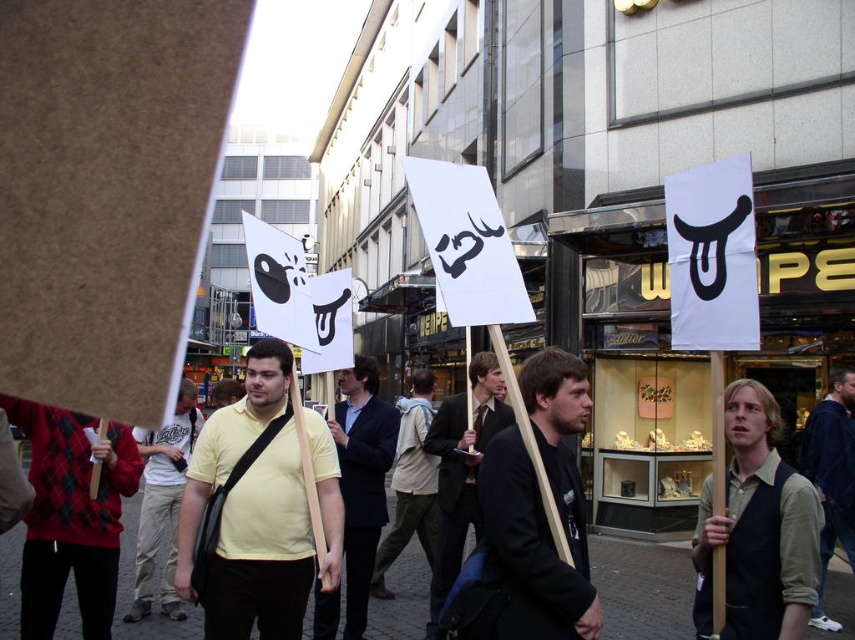
Between black matte suit at center and yellow shirt at center, which one has less height?

black matte suit at center is shorter.

Does black matte suit at center have a lesser height compared to yellow shirt at center?

Correct, black matte suit at center is not as tall as yellow shirt at center.

Identify the location of black matte suit at center. This screenshot has width=855, height=640. (538, 513).

The image size is (855, 640). I want to click on black matte suit at center, so click(x=538, y=513).

Is yellow matte shirt at center wider than black suit at center?

Yes.

Is yellow matte shirt at center further to the viewer compared to black suit at center?

That is False.

Is point (287, 497) positioned before point (447, 442)?

Yes, point (287, 497) is in front of point (447, 442).

The height and width of the screenshot is (640, 855). I want to click on yellow matte shirt at center, so click(x=262, y=548).

Who is taller, black suit at center or yellow shirt at center?

yellow shirt at center

Can you confirm if black suit at center is positioned below yellow shirt at center?

Yes, black suit at center is below yellow shirt at center.

Between point (464, 440) and point (158, 500), which one is positioned in front?

Point (464, 440) is more forward.

Where is `black suit at center`? The image size is (855, 640). black suit at center is located at coordinates (461, 468).